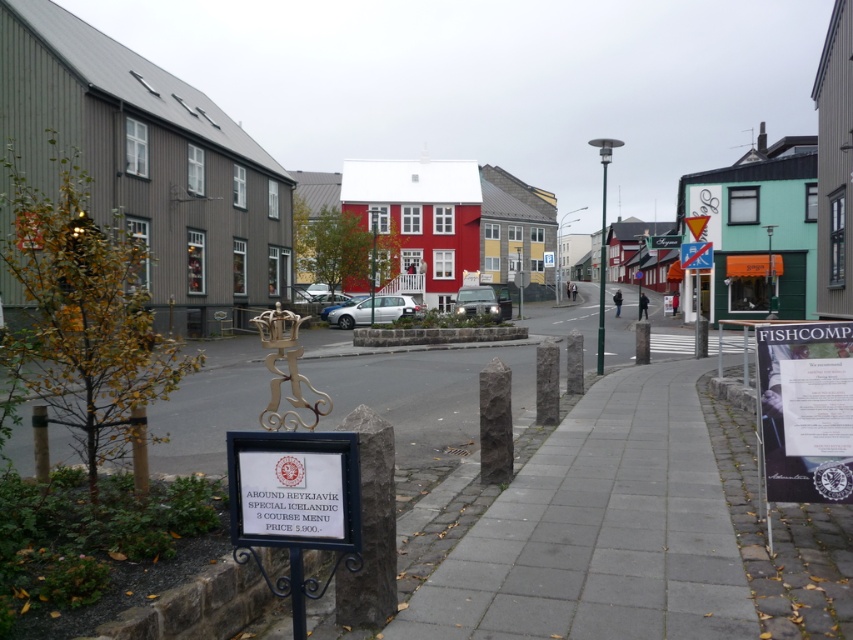
You are a tourist in Iceland and see the wooden signpost at center and the white plastic sign at center. Which one is taller?

The wooden signpost at center is taller than the white plastic sign at center.

You are a tourist walking along the sidewalk and want to read both the wooden signpost at center and the white plastic sign at center. Which sign should you look at first to ensure you don not have to walk past the other?

You should look at the wooden signpost at center first because it is closer to you than the white plastic sign at center, so you can read it before walking past the other one.

You are a tourist in Iceland and want to take a photo of both the wooden signpost at center and the white plastic sign at center in the same frame. Given that your camera has a maximum zoom range of 100 meters, can you capture both signs in a single photo without moving your position?

The wooden signpost at center and the white plastic sign at center are 252.94 meters apart from each other. Since your camera can only zoom up to 100 meters, you cannot capture both signs in a single photo without moving your position because the distance between them exceeds the camera zoom range.